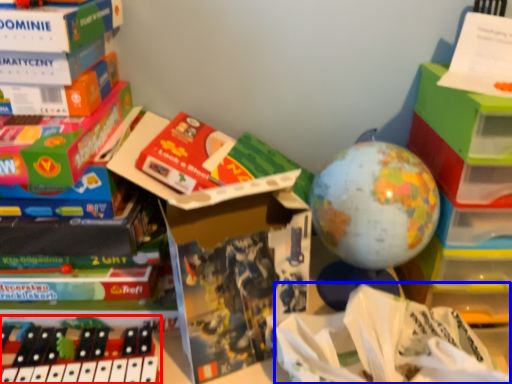
Question: Among these objects, which one is nearest to the camera, toy (highlighted by a red box) or wrapping paper (highlighted by a blue box)?

Choices:
 (A) toy
 (B) wrapping paper

Answer: (B)